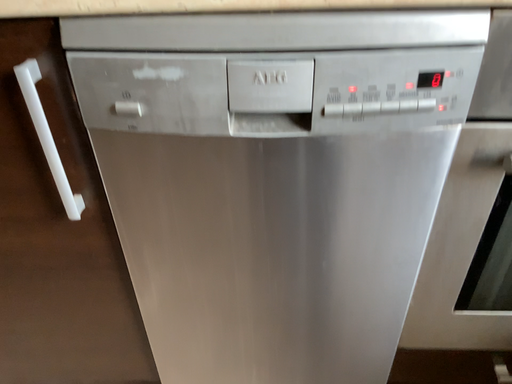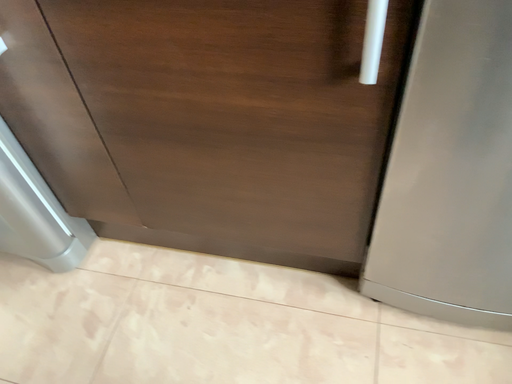
Question: How did the camera likely rotate when shooting the video?

Choices:
 (A) rotated left
 (B) rotated right

Answer: (A)